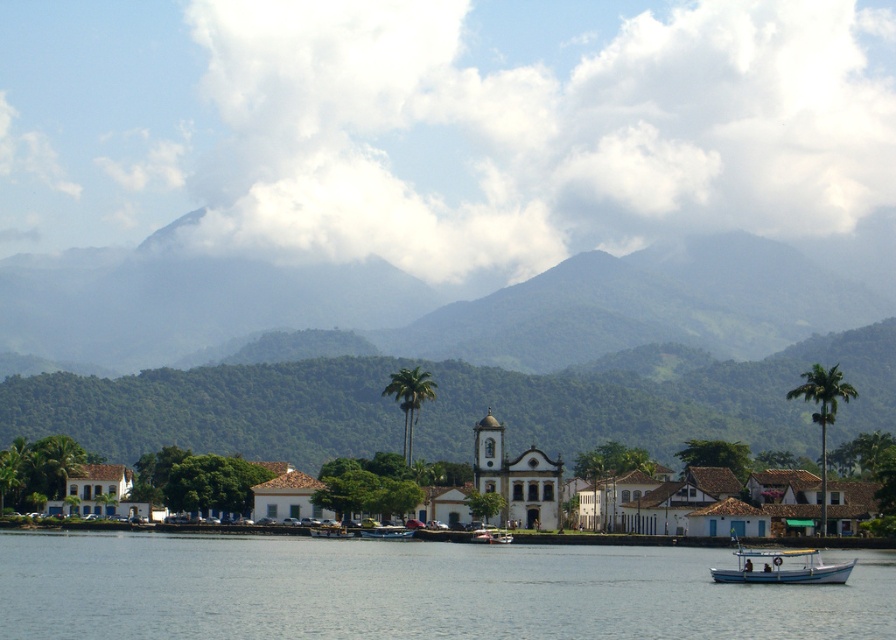
You are a tourist standing on the riverside and want to take a photo that includes both the white matte building at center and the green leafy palm tree at upper right. Which object will appear taller in your photo?

The green leafy palm tree at upper right will appear taller in the photo because the white matte building at center has a lesser height compared to green leafy palm tree at upper right.

You are standing at the riverside and want to determine which of the two points, point (x=511, y=429) or point (x=853, y=392), is closer to you. Based on the scene, which point is nearer?

Point (x=511, y=429) is closer to you because it is further to the viewer than point (x=853, y=392).

You are planning to take a photo of the green leafy palm tree at center and the metallic blue boat at center from a position near the riverbank. Based on their sizes, which object would appear bigger in your photo?

The green leafy palm tree at center appears bigger in the photo because it has a larger size compared to the metallic blue boat at center.